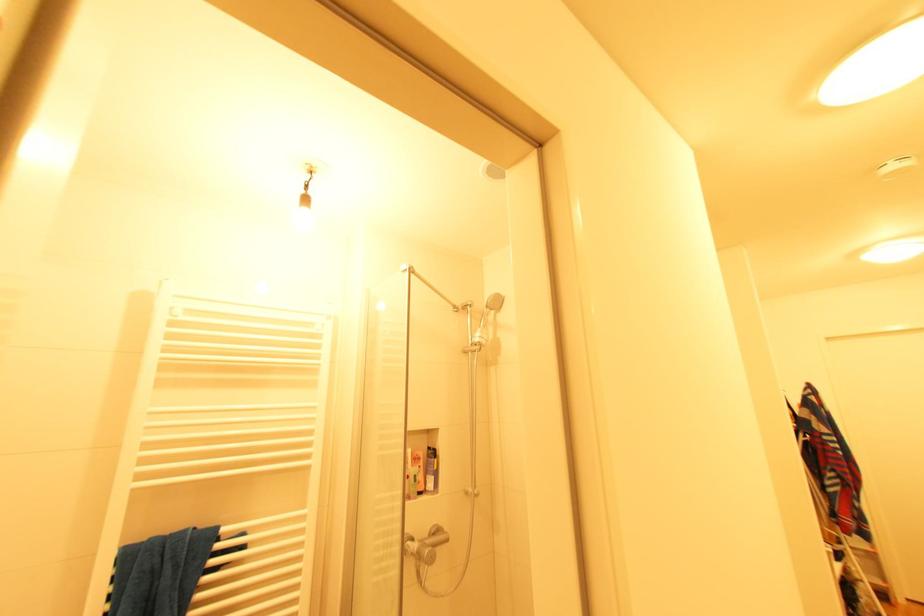
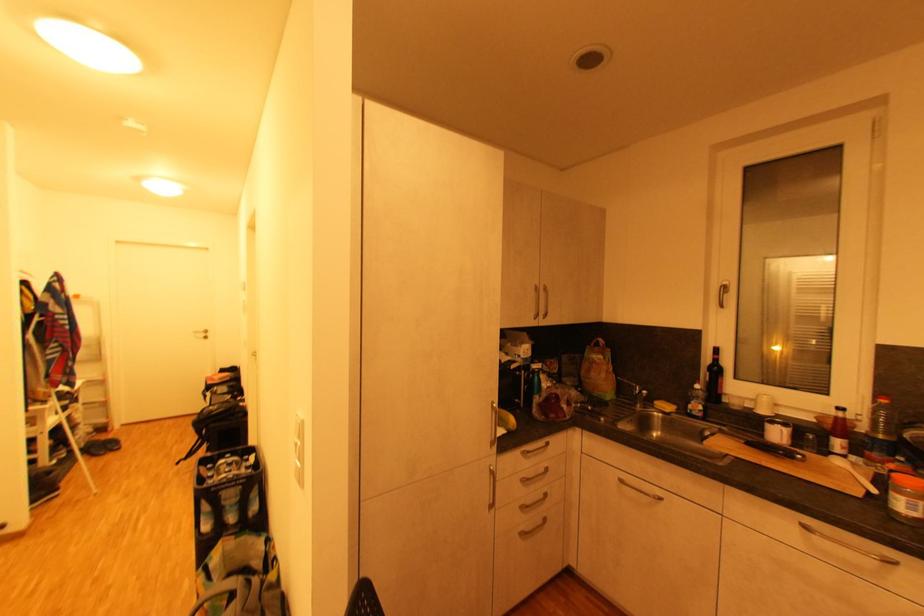
Question: The images are taken continuously from a first-person perspective. In which direction is your viewpoint rotating?

Choices:
 (A) Left
 (B) Right
 (C) Up
 (D) Down

Answer: (B)